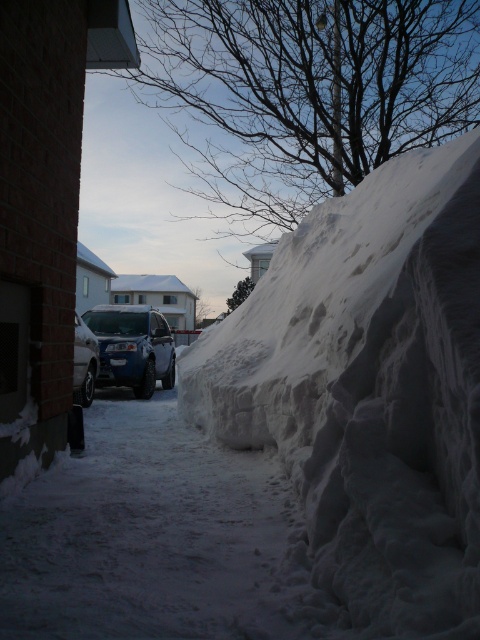
Looking at this image, you are a delivery person trying to park your van near the white fluffy snow at right and the silver metallic car at center. Based on the scene, which object is nearer to you as you approach the parking area?

The white fluffy snow at right is closer to the viewer than the silver metallic car at center, so the white fluffy snow at right would be nearer as you approach the parking area.